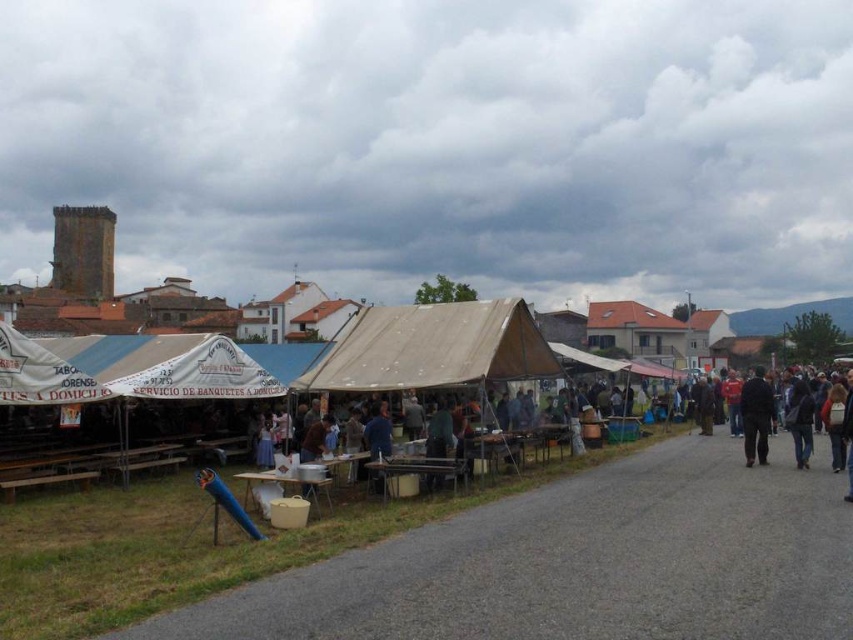
Question: Among these points, which one is nearest to the camera?

Choices:
 (A) (757, 428)
 (B) (534, 324)
 (C) (805, 436)
 (D) (50, 400)

Answer: (D)

Question: Observing the image, what is the correct spatial positioning of white fabric canopy at left in reference to dark blue fabric jacket at lower right?

Choices:
 (A) below
 (B) above

Answer: (B)

Question: Can you confirm if beige canvas tent at center is positioned to the right of white fabric canopy at left?

Choices:
 (A) no
 (B) yes

Answer: (B)

Question: Does beige canvas tent at center have a lesser width compared to white fabric canopy at left?

Choices:
 (A) no
 (B) yes

Answer: (A)

Question: Among these objects, which one is nearest to the camera?

Choices:
 (A) dark blue fabric at right
 (B) dark blue fabric jacket at lower right
 (C) white fabric canopy at left

Answer: (C)

Question: Estimate the real-world distances between objects in this image. Which object is farther from the dark blue fabric jacket at lower right?

Choices:
 (A) white fabric canopy at left
 (B) dark blue fabric at right

Answer: (A)